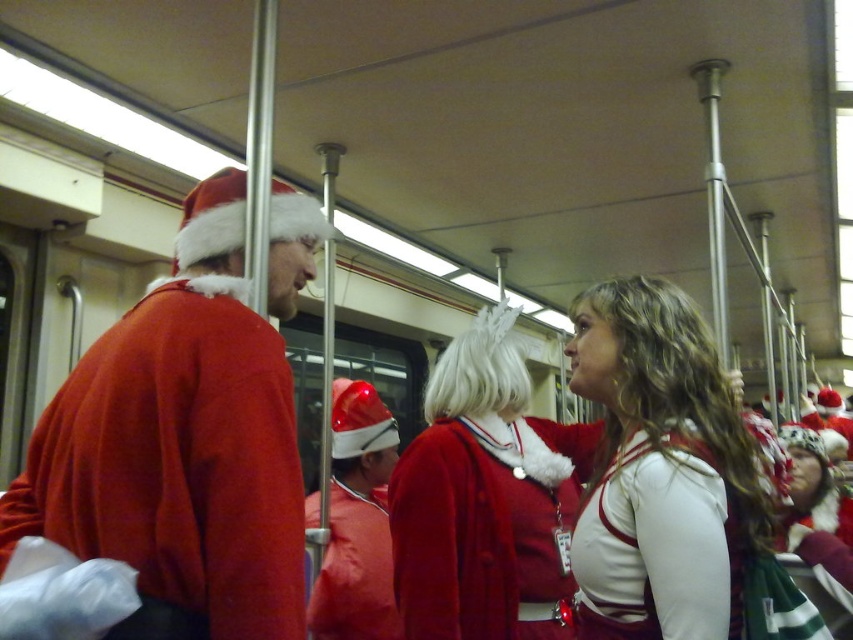
Can you confirm if fuzzy red coat at center is positioned to the right of matte red santa hat at center?

Indeed, fuzzy red coat at center is positioned on the right side of matte red santa hat at center.

Can you confirm if fuzzy red coat at center is bigger than matte red santa hat at center?

Correct, fuzzy red coat at center is larger in size than matte red santa hat at center.

Between point (519, 385) and point (335, 534), which one is positioned in front?

Point (519, 385) is more forward.

At what (x,y) coordinates should I click in order to perform the action: click on fuzzy red coat at center. Please return your answer as a coordinate pair (x, y). Looking at the image, I should click on (485, 499).

Which is behind, point (685, 602) or point (343, 636)?

The point (343, 636) is more distant.

Is white matte sweater at center below matte red santa hat at center?

Incorrect, white matte sweater at center is not positioned below matte red santa hat at center.

Between point (677, 531) and point (350, 406), which one is positioned behind?

Point (350, 406)

Locate an element on the screen. white matte sweater at center is located at coordinates pos(660,470).

Is point (73, 426) in front of point (653, 461)?

That is True.

Which is below, matte red sweater at left or white matte sweater at center?

white matte sweater at center

You are a GUI agent. You are given a task and a screenshot of the screen. Output one action in this format:
    pyautogui.click(x=<x>, y=<y>)
    Task: Click on the matte red sweater at left
    
    Given the screenshot: What is the action you would take?
    pyautogui.click(x=180, y=442)

This screenshot has width=853, height=640. I want to click on matte red sweater at left, so click(x=180, y=442).